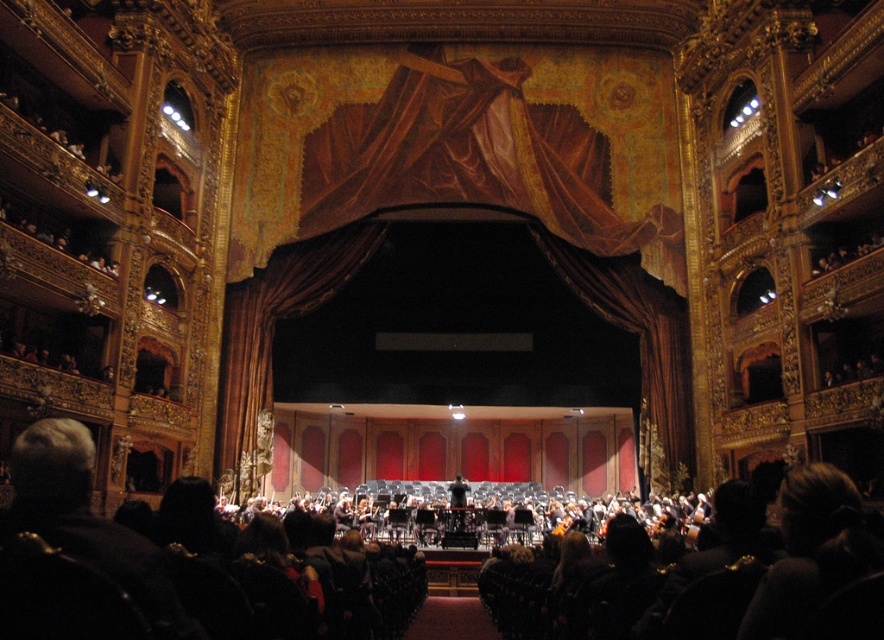
Is velvet drapery at center bigger than black smooth conductor at center?

Correct, velvet drapery at center is larger in size than black smooth conductor at center.

The width and height of the screenshot is (884, 640). I want to click on velvet drapery at center, so click(x=462, y=204).